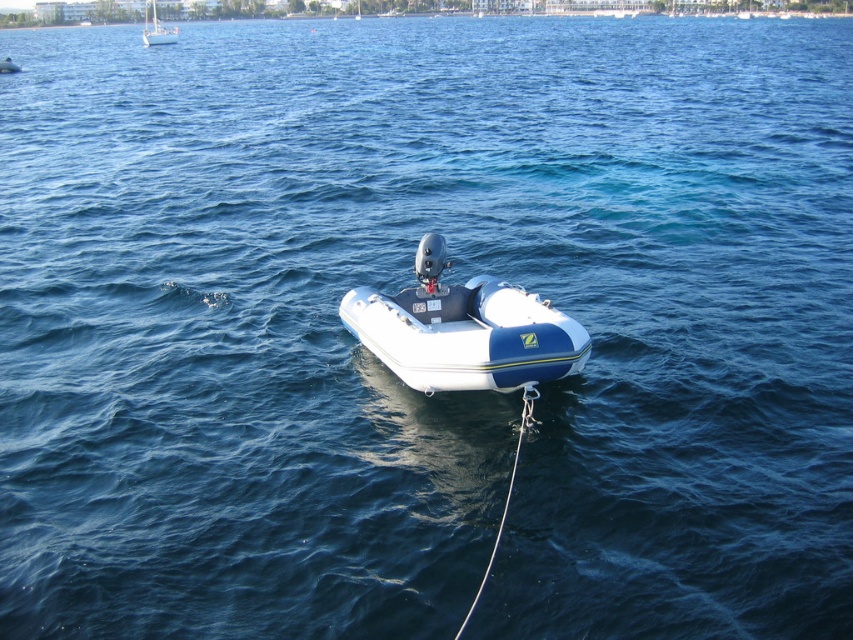
Looking at this image, is the position of white glossy sailboat at upper left more distant than that of blue rubber boat at center?

Yes, it is behind blue rubber boat at center.

Is white glossy sailboat at upper left bigger than blue rubber boat at center?

Yes, white glossy sailboat at upper left is bigger than blue rubber boat at center.

Which is in front, point (148, 4) or point (6, 65)?

Positioned in front is point (6, 65).

The height and width of the screenshot is (640, 853). I want to click on white glossy sailboat at upper left, so click(x=155, y=28).

Is white rubber boat at center thinner than white glossy sailboat at upper left?

Yes, white rubber boat at center is thinner than white glossy sailboat at upper left.

Is white rubber boat at center smaller than white glossy sailboat at upper left?

Yes.

This screenshot has height=640, width=853. Identify the location of white rubber boat at center. (463, 330).

Is white rubber boat at center above blue rubber boat at center?

No.

Describe the element at coordinates (463, 330) in the screenshot. I see `white rubber boat at center` at that location.

Find the location of `white rubber boat at center`. white rubber boat at center is located at coordinates (463, 330).